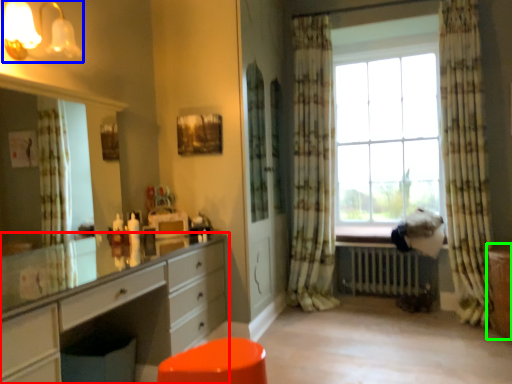
Question: Which is nearer to the chest of drawers (highlighted by a red box)? light fixture (highlighted by a blue box) or file cabinet (highlighted by a green box).

Choices:
 (A) light fixture
 (B) file cabinet

Answer: (A)